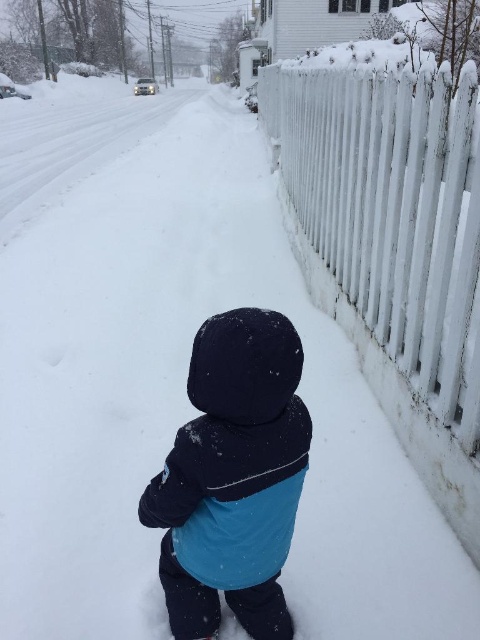
You are standing at the point marked as point (393, 212) in the image. What object is located at that point?

The point (393, 212) corresponds to the white painted wood fence at right.

You are standing at the point closer to the camera in the snowy scene. Which point are you at, point (x=459, y=353) or point (x=201, y=484)?

You are at point (x=201, y=484) because it is closer to the viewer than point (x=459, y=353).